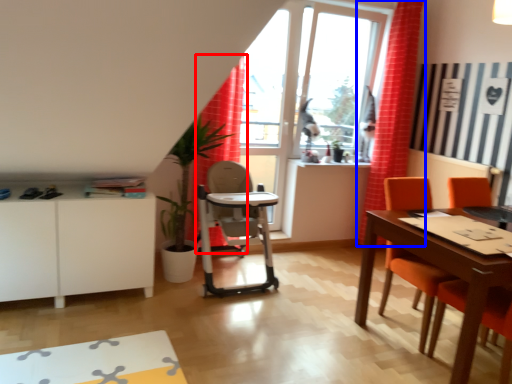
Question: Which of the following is the closest to the observer, curtain (highlighted by a red box) or curtain (highlighted by a blue box)?

Choices:
 (A) curtain
 (B) curtain

Answer: (A)